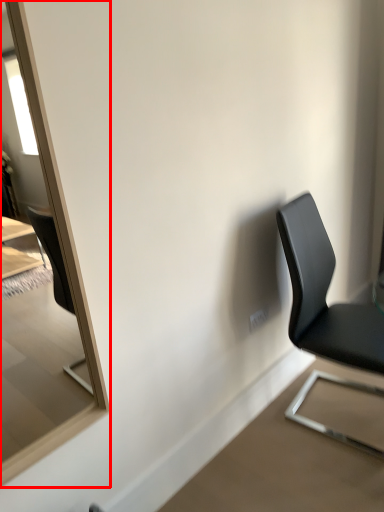
Question: From the image's perspective, where is mirror (annotated by the red box) located in relation to chair in the image?

Choices:
 (A) above
 (B) below

Answer: (A)